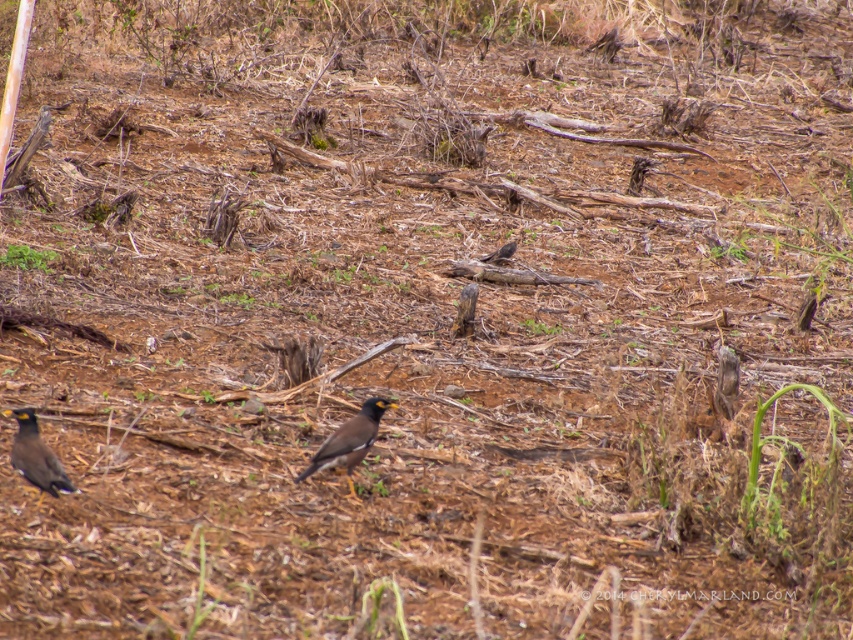
Looking at this image, you are a photographer trying to capture the brown speckled feathers at center in your shot. Your camera has a focus point at position 0.689, 0.410. Will the focus point align with the feathers?

Yes, the focus point at (x=349, y=440) will align with the brown speckled feathers at center since their 2D location is exactly at that coordinate.

You are standing in the field and want to place a small flag at each of the two points labeled point (65, 484) and point (490, 253). Which point will have its flag closer to you when viewed from your current position?

Point (65, 484) is closer to the viewer than point (490, 253), so the flag at point (65, 484) will be closer to you.